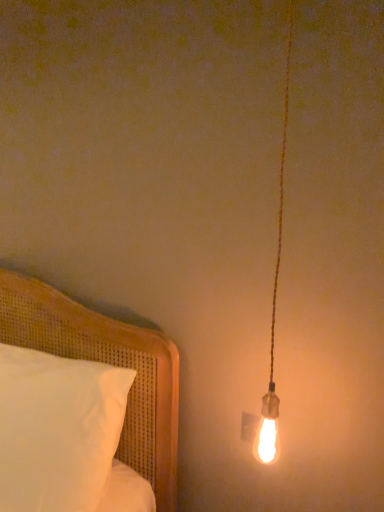
What do you see at coordinates (274, 309) in the screenshot? This screenshot has width=384, height=512. I see `matte gold bulb at right` at bounding box center [274, 309].

Where is `matte gold bulb at right`? The image size is (384, 512). matte gold bulb at right is located at coordinates (274, 309).

In order to face matte gold bulb at right, should I rotate leftwards or rightwards?

Turn right by 11.249 degrees to look at matte gold bulb at right.

The height and width of the screenshot is (512, 384). What do you see at coordinates (109, 362) in the screenshot?
I see `white cotton pillow at left` at bounding box center [109, 362].

Find the location of a particular element. white cotton pillow at left is located at coordinates (109, 362).

Where is `matte gold bulb at right`? matte gold bulb at right is located at coordinates (274, 309).

Is matte gold bulb at right at the right side of white cotton pillow at left?

Yes, matte gold bulb at right is to the right of white cotton pillow at left.

Is the depth of matte gold bulb at right less than that of white cotton pillow at left?

Yes.

Is point (276, 410) closer to viewer compared to point (29, 307)?

Yes, it is in front of point (29, 307).

From the image's perspective, is matte gold bulb at right below white cotton pillow at left?

Actually, matte gold bulb at right appears above white cotton pillow at left in the image.

From a real-world perspective, is matte gold bulb at right on white cotton pillow at left?

Indeed, from a real-world perspective, matte gold bulb at right stands above white cotton pillow at left.

Which of these two, matte gold bulb at right or white cotton pillow at left, is thinner?

With smaller width is matte gold bulb at right.

Is matte gold bulb at right shorter than white cotton pillow at left?

In fact, matte gold bulb at right may be taller than white cotton pillow at left.

Does matte gold bulb at right have a larger size compared to white cotton pillow at left?

Incorrect, matte gold bulb at right is not larger than white cotton pillow at left.

Is matte gold bulb at right not inside white cotton pillow at left?

Absolutely, matte gold bulb at right is external to white cotton pillow at left.

Is matte gold bulb at right touching white cotton pillow at left?

No, matte gold bulb at right is not in contact with white cotton pillow at left.

Is matte gold bulb at right aimed at white cotton pillow at left?

No, matte gold bulb at right is not oriented towards white cotton pillow at left.

Locate an element on the screen. This screenshot has height=512, width=384. lamp that appears on the right of white cotton pillow at left is located at coordinates [274, 309].

Does white cotton pillow at left appear on the right side of matte gold bulb at right?

In fact, white cotton pillow at left is to the left of matte gold bulb at right.

Is white cotton pillow at left positioned behind matte gold bulb at right?

Yes, white cotton pillow at left is further from the viewer.

Which is behind, point (111, 361) or point (273, 451)?

Point (111, 361)

From the image's perspective, is white cotton pillow at left above or below matte gold bulb at right?

Clearly, from the image's perspective, white cotton pillow at left is below matte gold bulb at right.

From a real-world perspective, does white cotton pillow at left sit lower than matte gold bulb at right?

Yes, from a real-world perspective, white cotton pillow at left is under matte gold bulb at right.

Between white cotton pillow at left and matte gold bulb at right, which one has larger width?

With larger width is white cotton pillow at left.

Considering the relative sizes of white cotton pillow at left and matte gold bulb at right in the image provided, is white cotton pillow at left taller than matte gold bulb at right?

No.

Considering the sizes of objects white cotton pillow at left and matte gold bulb at right in the image provided, who is bigger, white cotton pillow at left or matte gold bulb at right?

With larger size is white cotton pillow at left.

Do you think white cotton pillow at left is within matte gold bulb at right, or outside of it?

white cotton pillow at left lies outside matte gold bulb at right.

Does white cotton pillow at left touch matte gold bulb at right?

white cotton pillow at left and matte gold bulb at right are clearly separated.

Is white cotton pillow at left looking in the opposite direction of matte gold bulb at right?

No.

From the picture: How different are the orientations of white cotton pillow at left and matte gold bulb at right in degrees?

white cotton pillow at left and matte gold bulb at right are facing 0.509 degrees away from each other.

In the image, there is a white cotton pillow at left. Where is `lamp above it (from the image's perspective)`? This screenshot has height=512, width=384. lamp above it (from the image's perspective) is located at coordinates (x=274, y=309).

What are the coordinates of `bed below the matte gold bulb at right (from a real-world perspective)` in the screenshot? It's located at (109, 362).

Identify the location of lamp in front of the white cotton pillow at left. (274, 309).